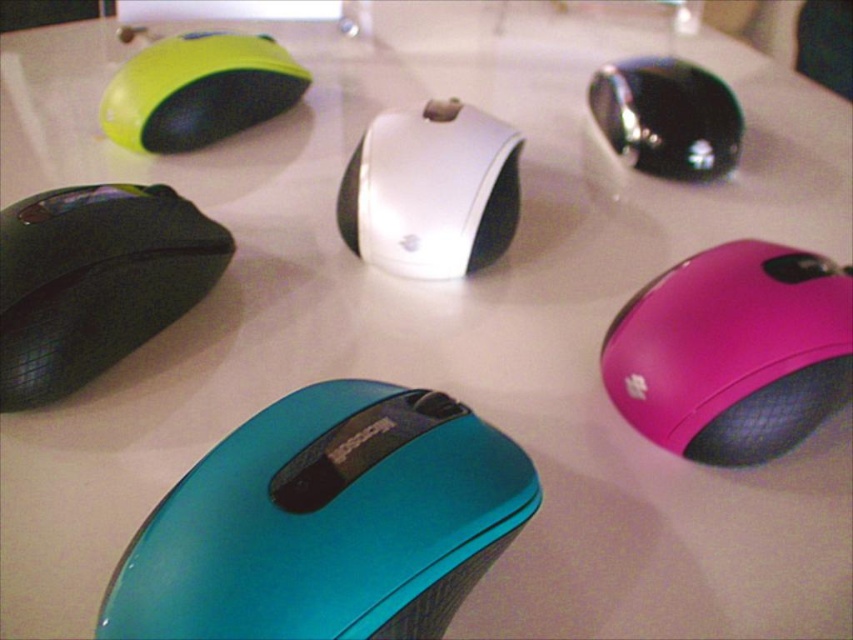
You are standing at the bottom left corner of the desk. You see two points marked on the desk surface, point 1 at coordinates point (267, 406) and point 2 at coordinates point (86, 355). Which point is closer to you?

Point (86, 355) is closer to you because it is in front of point (267, 406).

You are organizing computer mice on a desk and need to place a new mouse between the pink glossy mouse at lower right and the green rubberized mouse at upper left. Based on their positions, where should you place the new mouse?

The pink glossy mouse at lower right is below the green rubberized mouse at upper left, so you should place the new mouse between them in the middle area between their vertical positions.